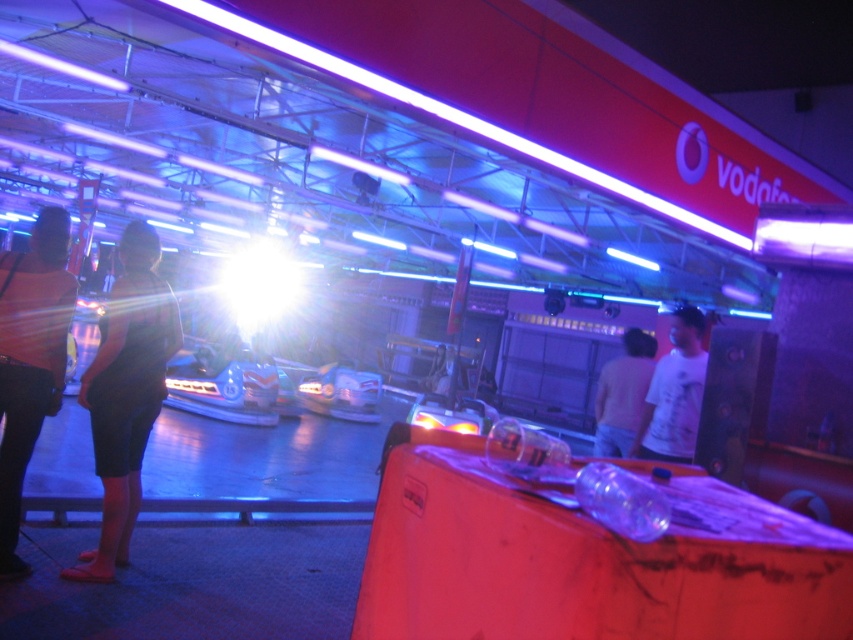
Between matte black dress at left and light blue plastic bumper car at center, which one appears on the right side from the viewer's perspective?

Positioned to the right is matte black dress at left.

Is matte black dress at left bigger than light blue plastic bumper car at center?

Actually, matte black dress at left might be smaller than light blue plastic bumper car at center.

Where is `matte black dress at left`? Image resolution: width=853 pixels, height=640 pixels. matte black dress at left is located at coordinates (30, 360).

Measure the distance from dark fabric shorts at left to white matte t-shirt at center.

A distance of 9.79 feet exists between dark fabric shorts at left and white matte t-shirt at center.

Who is positioned more to the right, dark fabric shorts at left or white matte t-shirt at center?

white matte t-shirt at center

Who is more distant from viewer, (120,321) or (700,333)?

The point (700,333) is more distant.

The height and width of the screenshot is (640, 853). I want to click on dark fabric shorts at left, so (126, 392).

Is dark fabric shorts at left bigger than light blue plastic bumper car at center?

Actually, dark fabric shorts at left might be smaller than light blue plastic bumper car at center.

The height and width of the screenshot is (640, 853). What do you see at coordinates (126, 392) in the screenshot?
I see `dark fabric shorts at left` at bounding box center [126, 392].

Locate an element on the screen. The image size is (853, 640). dark fabric shorts at left is located at coordinates tap(126, 392).